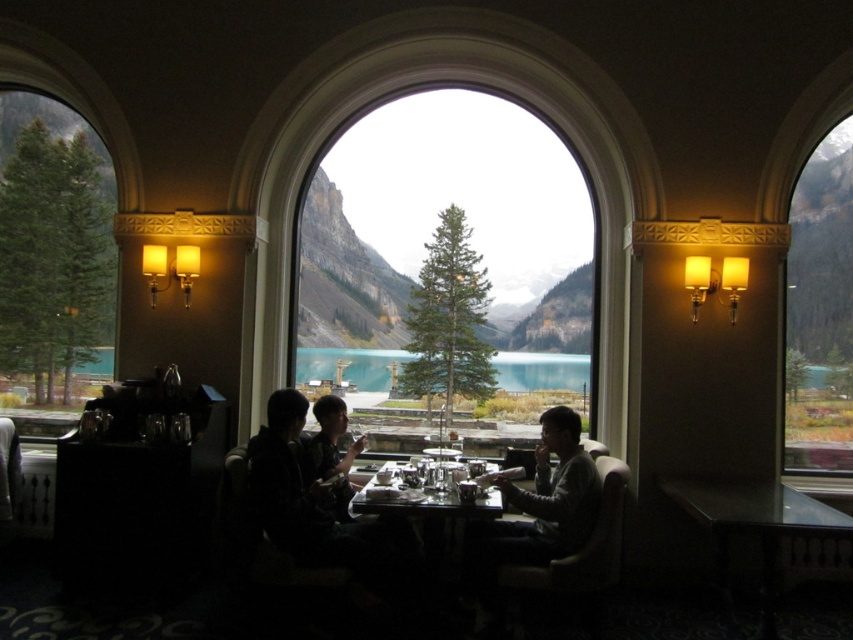
You are standing at the point labeled point (363, 490) and want to walk to the door located at the back of the room. There is an obstacle at point (506, 500). Can you walk around the obstacle to reach the door?

Point (506, 500) is in front of point (363, 490), so you cannot walk around the obstacle to reach the door because the obstacle is blocking your path.

You are a guest at this dining table and want to place a small ornament between the dark gray hoodie at center and the metallic silver dinnerware at center. Which object should you place it closer to if you want the ornament to be closer to the taller object?

The dark gray hoodie at center is taller than the metallic silver dinnerware at center, so you should place the ornament closer to the dark gray hoodie at center to be near the taller object.